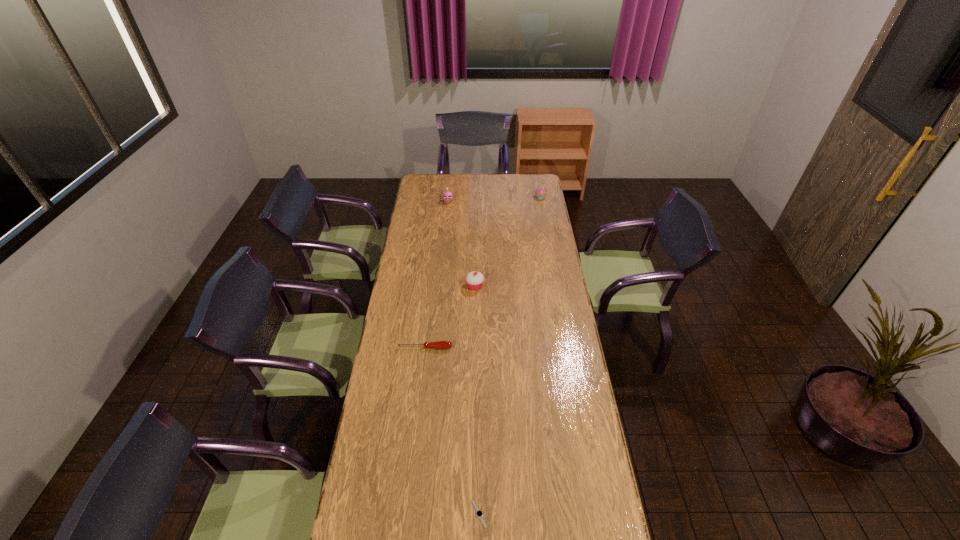
Locate which cupcake ranks in proximity to the second nearest object. Please provide its 2D coordinates. Your answer should be formatted as a tuple, i.e. [(x, y)], where the tuple contains the x and y coordinates of a point satisfying the conditions above.

[(474, 279)]

Locate an element on the screen. The height and width of the screenshot is (540, 960). the second closest cupcake relative to the rightmost object is located at coordinates (474, 279).

Locate an element on the screen. free location that satisfies the following two spatial constraints: 1. on the face of the third nearest object; 2. on the right side of the leftmost cupcake is located at coordinates (440, 286).

Identify the location of free space that satisfies the following two spatial constraints: 1. on the front side of the screwdriver; 2. on the left side of the watch. (406, 514).

Image resolution: width=960 pixels, height=540 pixels. Find the location of `free space that satisfies the following two spatial constraints: 1. on the front side of the fourth farthest object; 2. on the right side of the watch`. free space that satisfies the following two spatial constraints: 1. on the front side of the fourth farthest object; 2. on the right side of the watch is located at coordinates (406, 514).

This screenshot has height=540, width=960. I want to click on vacant space that satisfies the following two spatial constraints: 1. on the front side of the second cupcake from left to right; 2. on the right side of the nearest object, so click(472, 514).